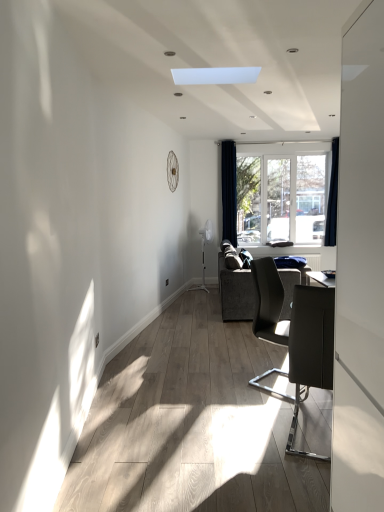
This screenshot has height=512, width=384. I want to click on clear glass window at center, so click(x=282, y=198).

What is the approximate width of dark blue fabric curtain at right, the second curtain from the left?

It is 13.24 centimeters.

Consider the image. Measure the distance between point (269, 327) and camera.

A distance of 3.33 meters exists between point (269, 327) and camera.

The width and height of the screenshot is (384, 512). Find the location of `dark blue velvet curtain at right, the first curtain when ordered from left to right`. dark blue velvet curtain at right, the first curtain when ordered from left to right is located at coordinates (229, 191).

How different are the orientations of dark gray fabric couch at center and clear glass window at center in degrees?

There is a 88.8-degree angle between the facing directions of dark gray fabric couch at center and clear glass window at center.

Can you confirm if dark gray fabric couch at center is shorter than clear glass window at center?

Yes, dark gray fabric couch at center is shorter than clear glass window at center.

In the scene shown: From a real-world perspective, is dark gray fabric couch at center positioned over clear glass window at center based on gravity?

No, from a real-world perspective, dark gray fabric couch at center is not over clear glass window at center

From the picture: Is dark gray fabric couch at center turned away from clear glass window at center?

dark gray fabric couch at center does not have its back to clear glass window at center.

From a real-world perspective, between clear glass window at center and dark gray fabric couch at center, who is vertically lower?

In real-world perspective, dark gray fabric couch at center is lower.

Is clear glass window at center inside the boundaries of dark gray fabric couch at center, or outside?

clear glass window at center is not enclosed by dark gray fabric couch at center.

Would you say white glossy screen door at right is a long distance from dark gray fabric couch at center?

Yes, white glossy screen door at right and dark gray fabric couch at center are located far from each other.

Which is more to the left, white glossy screen door at right or dark gray fabric couch at center?

From the viewer's perspective, white glossy screen door at right appears more on the left side.

From a real-world perspective, which is physically below, white glossy screen door at right or dark gray fabric couch at center?

dark gray fabric couch at center, from a real-world perspective.

Considering the relative sizes of matte black chair at center right, arranged as the 2th chair when viewed from the front, and dark gray fabric couch at center in the image provided, is matte black chair at center right, arranged as the 2th chair when viewed from the front, bigger than dark gray fabric couch at center?

Incorrect, matte black chair at center right, arranged as the 2th chair when viewed from the front, is not larger than dark gray fabric couch at center.

Is matte black chair at center right, positioned as the first chair in back-to-front order, to the left of dark gray fabric couch at center from the viewer's perspective?

Indeed, matte black chair at center right, positioned as the first chair in back-to-front order, is positioned on the left side of dark gray fabric couch at center.

From the image's perspective, relative to dark gray fabric couch at center, is matte black chair at center right, positioned as the first chair in back-to-front order, above or below?

Clearly, from the image's perspective, matte black chair at center right, positioned as the first chair in back-to-front order, is below dark gray fabric couch at center.

Is matte black chair at center right, positioned as the first chair in back-to-front order, to the left of white glossy screen door at right from the viewer's perspective?

Incorrect, matte black chair at center right, positioned as the first chair in back-to-front order, is not on the left side of white glossy screen door at right.

From the image's perspective, who appears lower, matte black chair at center right, positioned as the first chair in back-to-front order, or white glossy screen door at right?

From the image's view, matte black chair at center right, positioned as the first chair in back-to-front order, is below.

From a real-world perspective, is matte black chair at center right, positioned as the first chair in back-to-front order, under white glossy screen door at right?

Indeed, from a real-world perspective, matte black chair at center right, positioned as the first chair in back-to-front order, is positioned beneath white glossy screen door at right.

This screenshot has height=512, width=384. Identify the location of screen door on the left of matte black chair at center right, positioned as the first chair in back-to-front order. (360, 270).

Can you confirm if white glossy screen door at right is taller than dark blue fabric curtain at right, the second curtain from the left?

Correct, white glossy screen door at right is much taller as dark blue fabric curtain at right, the second curtain from the left.

Is white glossy screen door at right aimed at dark blue fabric curtain at right, which is the first curtain in right-to-left order?

No, white glossy screen door at right is not aimed at dark blue fabric curtain at right, which is the first curtain in right-to-left order.

Considering the positions of point (352, 48) and point (335, 213), is point (352, 48) closer or farther from the camera than point (335, 213)?

Clearly, point (352, 48) is closer to the camera than point (335, 213).

Where is `chair that is the 2nd one below the dark blue velvet curtain at right, acting as the second curtain starting from the right (from a real-world perspective)`? chair that is the 2nd one below the dark blue velvet curtain at right, acting as the second curtain starting from the right (from a real-world perspective) is located at coordinates (310, 348).

Is the position of matte black chair at right, which is the second chair from back to front, more distant than that of dark blue velvet curtain at right, acting as the second curtain starting from the right?

No.

Is matte black chair at right, which is the second chair from back to front, directly adjacent to dark blue velvet curtain at right, acting as the second curtain starting from the right?

No, matte black chair at right, which is the second chair from back to front, is not touching dark blue velvet curtain at right, acting as the second curtain starting from the right.

Find the location of a particular element. studio couch located below the clear glass window at center (from the image's perspective) is located at coordinates (236, 292).

The height and width of the screenshot is (512, 384). In order to click on window above the dark gray fabric couch at center (from the image's perspective) in this screenshot , I will do `click(282, 198)`.

Based on their spatial positions, is dark blue velvet curtain at right, acting as the second curtain starting from the right, or clear glass window at center further from dark blue fabric curtain at right, which is the first curtain in right-to-left order?

dark blue velvet curtain at right, acting as the second curtain starting from the right, is further to dark blue fabric curtain at right, which is the first curtain in right-to-left order.

From the image, which object appears to be nearer to dark blue fabric curtain at right, which is the first curtain in right-to-left order, dark gray fabric couch at center or dark blue velvet curtain at right, the first curtain when ordered from left to right?

The object closer to dark blue fabric curtain at right, which is the first curtain in right-to-left order, is dark blue velvet curtain at right, the first curtain when ordered from left to right.

Considering their positions, is dark blue velvet curtain at right, acting as the second curtain starting from the right, positioned further to clear glass window at center than dark blue fabric curtain at right, the second curtain from the left?

dark blue fabric curtain at right, the second curtain from the left, is further to clear glass window at center.

Looking at this image, considering their positions, is dark blue fabric curtain at right, the second curtain from the left, positioned further to white glossy screen door at right than dark gray fabric couch at center?

Among the two, dark blue fabric curtain at right, the second curtain from the left, is located further to white glossy screen door at right.

When comparing their distances from matte black chair at right, which is the second chair from back to front, does dark blue fabric curtain at right, the second curtain from the left, or matte black chair at center right, arranged as the 2th chair when viewed from the front, seem closer?

matte black chair at center right, arranged as the 2th chair when viewed from the front, is closer to matte black chair at right, which is the second chair from back to front.

Estimate the real-world distances between objects in this image. Which object is further from matte black chair at right, the 1th chair positioned from the front, matte black chair at center right, arranged as the 2th chair when viewed from the front, or clear glass window at center?

The object further to matte black chair at right, the 1th chair positioned from the front, is clear glass window at center.

Looking at the image, which one is located closer to dark gray fabric couch at center, dark blue velvet curtain at right, the first curtain when ordered from left to right, or clear glass window at center?

The object closer to dark gray fabric couch at center is dark blue velvet curtain at right, the first curtain when ordered from left to right.

From the image, which object appears to be nearer to dark gray fabric couch at center, white glossy screen door at right or matte black chair at center right, arranged as the 2th chair when viewed from the front?

matte black chair at center right, arranged as the 2th chair when viewed from the front, is closer to dark gray fabric couch at center.

Identify the location of chair positioned between matte black chair at right, the 1th chair positioned from the front, and dark blue velvet curtain at right, the first curtain when ordered from left to right, from near to far. The width and height of the screenshot is (384, 512). (269, 303).

This screenshot has width=384, height=512. Identify the location of studio couch between white glossy screen door at right and dark blue fabric curtain at right, which is the first curtain in right-to-left order, in the front-back direction. pyautogui.click(x=236, y=292).

What are the coordinates of `studio couch between matte black chair at center right, positioned as the first chair in back-to-front order, and dark blue velvet curtain at right, acting as the second curtain starting from the right, along the z-axis` in the screenshot? It's located at (236, 292).

You are a GUI agent. You are given a task and a screenshot of the screen. Output one action in this format:
    pyautogui.click(x=<x>, y=<y>)
    Task: Click on the chair between matte black chair at right, the 1th chair positioned from the front, and clear glass window at center, along the z-axis
    Image resolution: width=384 pixels, height=512 pixels.
    Given the screenshot: What is the action you would take?
    pyautogui.click(x=269, y=303)